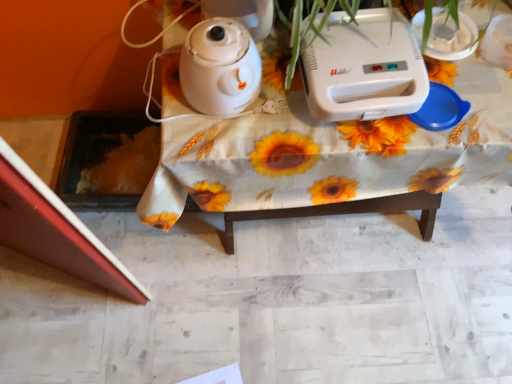
The width and height of the screenshot is (512, 384). Identify the location of white plastic toaster at upper center. (362, 68).

What are the coordinates of `white plastic table at center` in the screenshot? It's located at (319, 161).

Would you say white plastic toaster at upper center is part of white glossy kettle at upper center's contents?

Actually, white plastic toaster at upper center is outside white glossy kettle at upper center.

Are white glossy kettle at upper center and white plastic toaster at upper center far apart?

That's not correct — white glossy kettle at upper center is a little close to white plastic toaster at upper center.

The width and height of the screenshot is (512, 384). Find the location of `kettle on the left side of white plastic toaster at upper center`. kettle on the left side of white plastic toaster at upper center is located at coordinates (220, 68).

Between white glossy kettle at upper center and white plastic toaster at upper center, which one is positioned behind?

white plastic toaster at upper center is behind.

Is white plastic toaster at upper center taller or shorter than white glossy kettle at upper center?

white plastic toaster at upper center is shorter than white glossy kettle at upper center.

Is white plastic toaster at upper center beside white glossy kettle at upper center?

No, white plastic toaster at upper center is not making contact with white glossy kettle at upper center.

Is white plastic toaster at upper center positioned beyond the bounds of white glossy kettle at upper center?

Indeed, white plastic toaster at upper center is completely outside white glossy kettle at upper center.

Considering the sizes of objects white plastic toaster at upper center and white glossy kettle at upper center in the image provided, who is bigger, white plastic toaster at upper center or white glossy kettle at upper center?

white plastic toaster at upper center.

Can you confirm if white plastic toaster at upper center is positioned to the left of white plastic table at center?

Indeed, white plastic toaster at upper center is positioned on the left side of white plastic table at center.

Is white plastic toaster at upper center further to camera compared to white plastic table at center?

No, it is not.

From a real-world perspective, is white plastic toaster at upper center positioned under white plastic table at center based on gravity?

Incorrect, from a real-world perspective, white plastic toaster at upper center is higher than white plastic table at center.

Considering the relative sizes of white plastic toaster at upper center and white plastic table at center in the image provided, is white plastic toaster at upper center bigger than white plastic table at center?

No.

Considering the relative positions of white plastic table at center and white glossy kettle at upper center in the image provided, is white plastic table at center to the left or to the right of white glossy kettle at upper center?

Clearly, white plastic table at center is on the right of white glossy kettle at upper center in the image.

From a real-world perspective, between white plastic table at center and white glossy kettle at upper center, who is vertically lower?

white plastic table at center, from a real-world perspective.

Based on the photo, who is taller, white plastic table at center or white glossy kettle at upper center?

With more height is white plastic table at center.

Can you confirm if white plastic table at center is bigger than white glossy kettle at upper center?

Correct, white plastic table at center is larger in size than white glossy kettle at upper center.

From the image's perspective, does white glossy kettle at upper center appear lower than white plastic table at center?

No.

From a real-world perspective, between white glossy kettle at upper center and white plastic table at center, who is vertically higher?

white glossy kettle at upper center is physically above.

Is white glossy kettle at upper center with white plastic table at center?

No, white glossy kettle at upper center is not touching white plastic table at center.

Considering the relative sizes of white glossy kettle at upper center and white plastic table at center in the image provided, is white glossy kettle at upper center thinner than white plastic table at center?

Yes, white glossy kettle at upper center is thinner than white plastic table at center.

From a real-world perspective, between white plastic table at center and white plastic toaster at upper center, who is vertically lower?

white plastic table at center, from a real-world perspective.

Between white plastic table at center and white plastic toaster at upper center, which one has larger width?

With larger width is white plastic table at center.

Consider the image. Between white plastic table at center and white plastic toaster at upper center, which one has larger size?

Bigger between the two is white plastic table at center.

From the image's perspective, is white plastic table at center on top of white plastic toaster at upper center?

No, from the image's perspective, white plastic table at center is not on top of white plastic toaster at upper center.

Where is `appliance located behind the white glossy kettle at upper center`? appliance located behind the white glossy kettle at upper center is located at coordinates (362, 68).

This screenshot has height=384, width=512. In order to click on appliance located on the right of white glossy kettle at upper center in this screenshot , I will do `click(362, 68)`.

From the image, which object appears to be nearer to white glossy kettle at upper center, white plastic toaster at upper center or white plastic table at center?

Among the two, white plastic table at center is located nearer to white glossy kettle at upper center.

Considering their positions, is white glossy kettle at upper center positioned further to white plastic table at center than white plastic toaster at upper center?

white glossy kettle at upper center is positioned further to the anchor white plastic table at center.

From the image, which object appears to be nearer to white plastic toaster at upper center, white glossy kettle at upper center or white plastic table at center?

white plastic table at center is positioned closer to the anchor white plastic toaster at upper center.

When comparing their distances from white glossy kettle at upper center, does white plastic table at center or white plastic toaster at upper center seem closer?

The object closer to white glossy kettle at upper center is white plastic table at center.

When comparing their distances from white plastic toaster at upper center, does white plastic table at center or white glossy kettle at upper center seem further?

The object further to white plastic toaster at upper center is white glossy kettle at upper center.

Looking at the image, which one is located further to white plastic table at center, white plastic toaster at upper center or white glossy kettle at upper center?

white glossy kettle at upper center lies further to white plastic table at center than the other object.

Image resolution: width=512 pixels, height=384 pixels. Find the location of `appliance situated between white glossy kettle at upper center and white plastic table at center from left to right`. appliance situated between white glossy kettle at upper center and white plastic table at center from left to right is located at coordinates (362, 68).